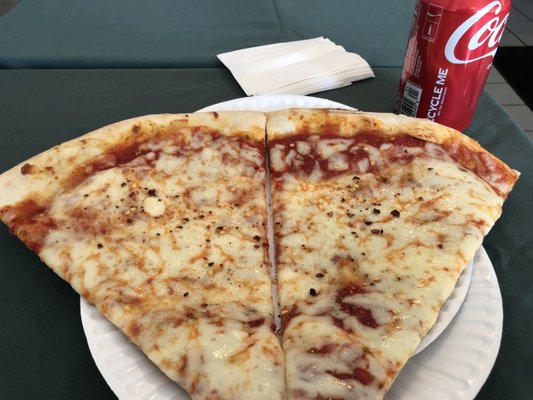
Find the location of a particular element. napkins is located at coordinates (292, 68).